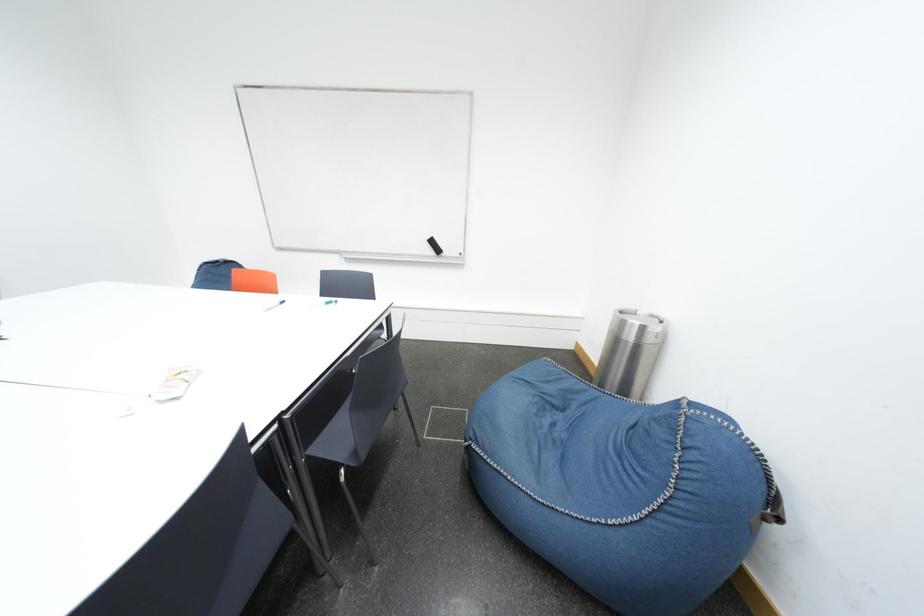
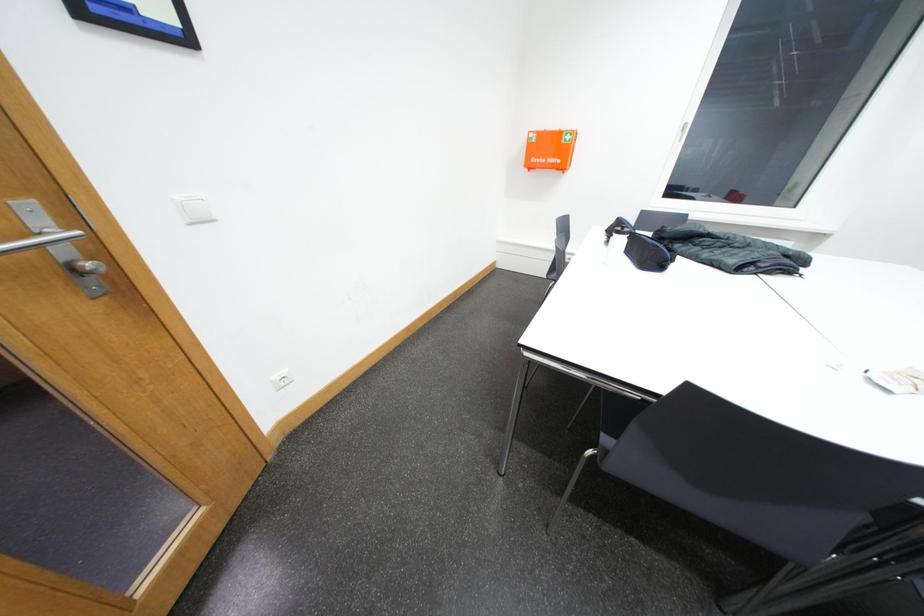
Based on the photo, the first image is from the beginning of the video and the second image is from the end. How did the camera likely rotate when shooting the video?

The rotation direction of the camera is left-down.